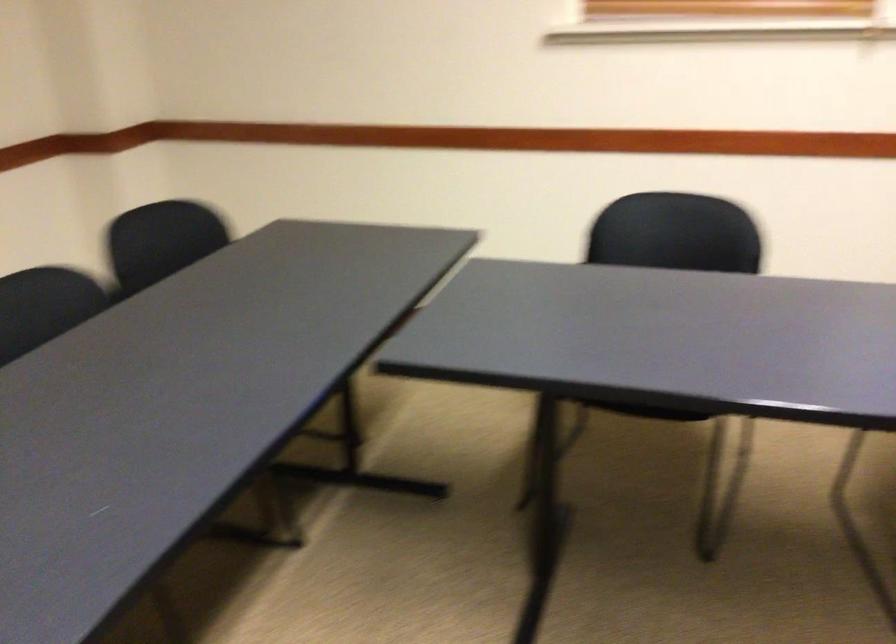
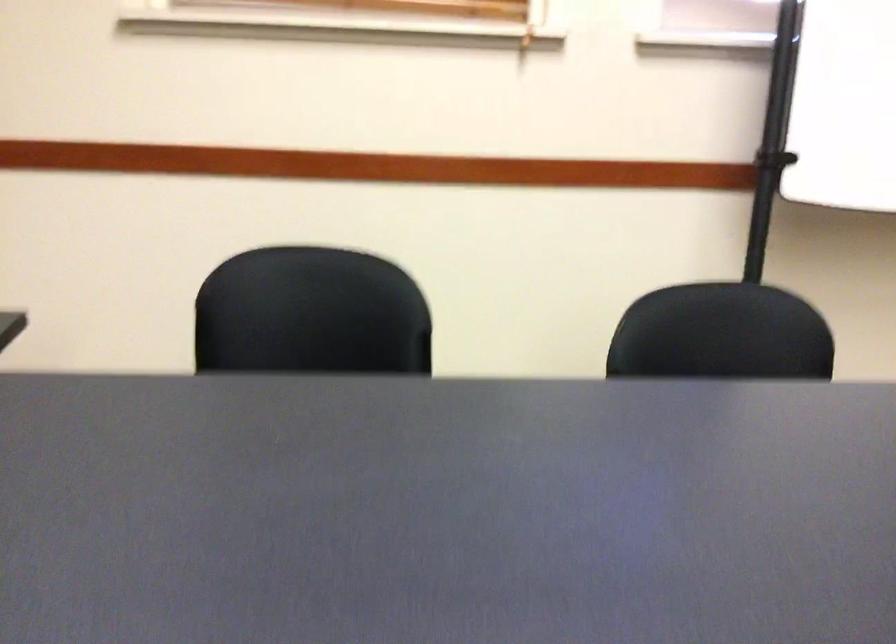
What movement of the cameraman would produce the second image?

The cameraman walked toward right, forward.